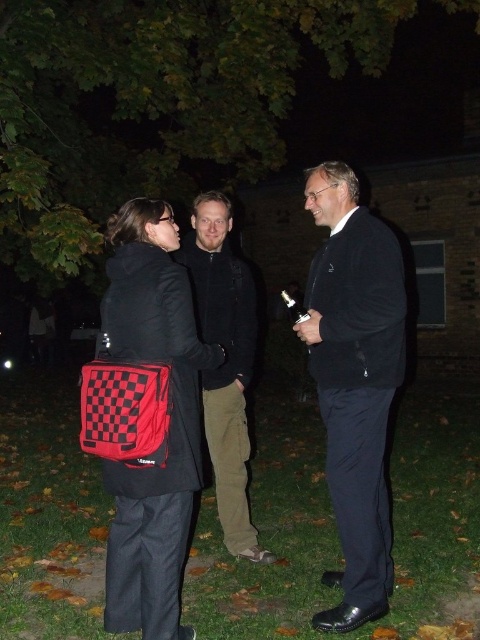
Looking at this image, you are at a nighttime gathering in a park. You see a matte black suit at center and a checkerboard fabric bag at left. Which object is higher up in the image?

The matte black suit at center is located above the checkerboard fabric bag at left, so the matte black suit at center is higher up in the image.